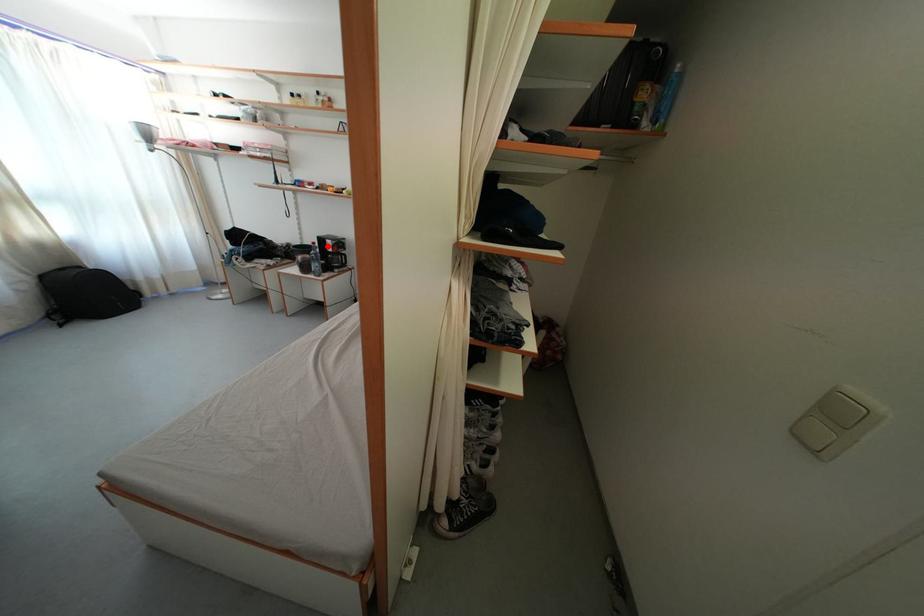
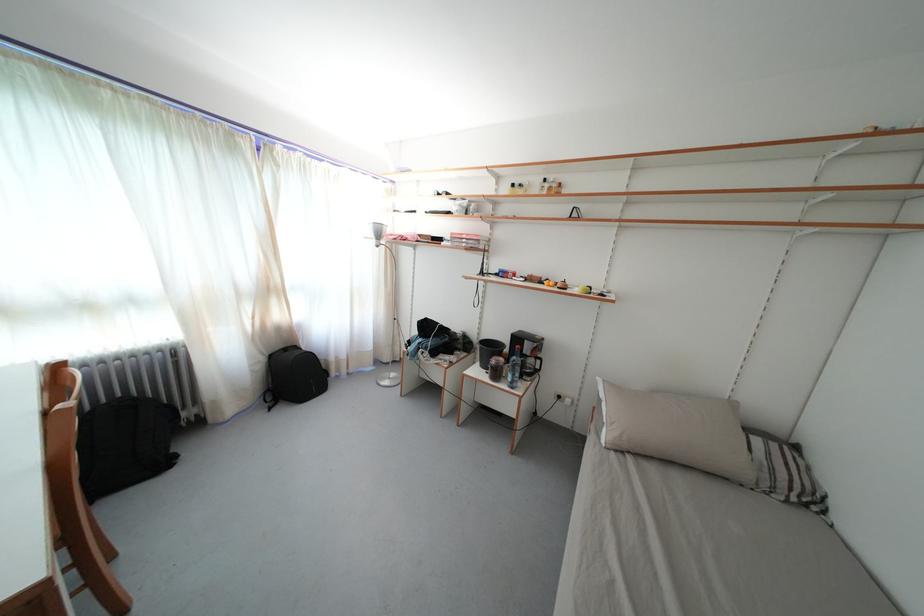
Question: I am providing you with two images of the same scene from different viewpoints. Given a red point in image1, look at the same physical point in image2. Is it:

Choices:
 (A) Closer to the viewpoint
 (B) Farther from the viewpoint

Answer: (B)